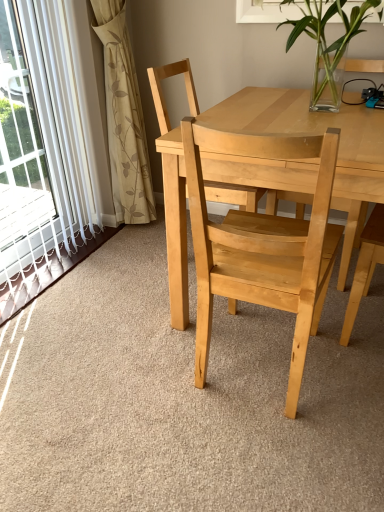
The height and width of the screenshot is (512, 384). I want to click on vacant space to the left of natural wood chair at center, marked as the 2th chair in a front-to-back arrangement, so click(133, 265).